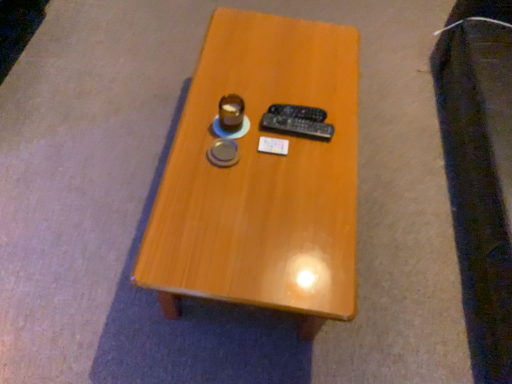
Question: Should I look upward or downward to see wooden table at center?

Choices:
 (A) up
 (B) down

Answer: (A)

Question: From the image's perspective, is black plastic remote control at center, which is counted as the second remote control, starting from the back, beneath matte brown coffee cup at center?

Choices:
 (A) yes
 (B) no

Answer: (A)

Question: From the image's perspective, is black plastic remote control at center, arranged as the first remote control when viewed from the front, on top of matte brown coffee cup at center?

Choices:
 (A) yes
 (B) no

Answer: (B)

Question: Is black plastic remote control at center, which is counted as the second remote control, starting from the back, facing towards matte brown coffee cup at center?

Choices:
 (A) yes
 (B) no

Answer: (B)

Question: Is black plastic remote control at center, arranged as the first remote control when viewed from the front, placed right next to matte brown coffee cup at center?

Choices:
 (A) yes
 (B) no

Answer: (B)

Question: Does black plastic remote control at center, arranged as the first remote control when viewed from the front, have a greater height compared to matte brown coffee cup at center?

Choices:
 (A) no
 (B) yes

Answer: (A)

Question: Is black plastic remote control at center, which is counted as the second remote control, starting from the back, oriented away from matte brown coffee cup at center?

Choices:
 (A) no
 (B) yes

Answer: (B)

Question: Are matte brown coffee cup at center and black plastic remote control at center, arranged as the 1th remote control when viewed from the back, making contact?

Choices:
 (A) no
 (B) yes

Answer: (A)

Question: Does matte brown coffee cup at center turn towards black plastic remote control at center, marked as the second remote control in a front-to-back arrangement?

Choices:
 (A) no
 (B) yes

Answer: (B)

Question: Does matte brown coffee cup at center have a larger size compared to black plastic remote control at center, arranged as the 1th remote control when viewed from the back?

Choices:
 (A) yes
 (B) no

Answer: (A)

Question: Is black plastic remote control at center, arranged as the 1th remote control when viewed from the back, completely or partially inside matte brown coffee cup at center?

Choices:
 (A) no
 (B) yes

Answer: (A)

Question: Does matte brown coffee cup at center have a lesser width compared to black plastic remote control at center, marked as the second remote control in a front-to-back arrangement?

Choices:
 (A) no
 (B) yes

Answer: (B)

Question: From the image's perspective, is matte brown coffee cup at center located beneath black plastic remote control at center, arranged as the 1th remote control when viewed from the back?

Choices:
 (A) no
 (B) yes

Answer: (B)

Question: Is wooden table at center not close to black plastic remote control at center, arranged as the 1th remote control when viewed from the back?

Choices:
 (A) yes
 (B) no

Answer: (B)